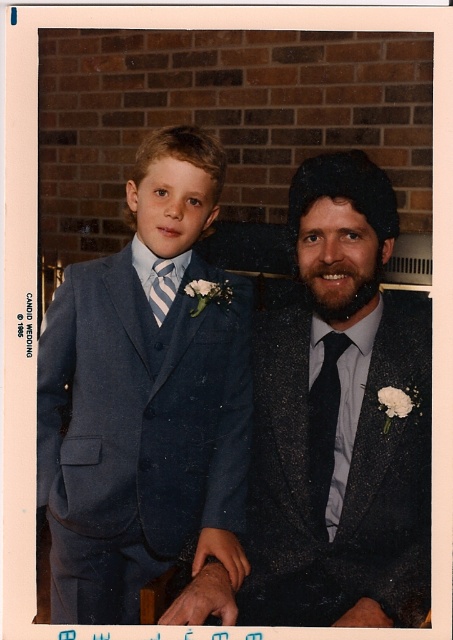
You are a photographer at a wedding and need to position the two individuals so that their heights are balanced in the photo. The subjects are wearing the matte blue suit at left and the matte black suit at center. Which suit should you move forward to make them appear the same height in the photo?

The matte blue suit at left is much taller than the matte black suit at center. To balance their heights in the photo, move the matte black suit at center forward so it appears taller, while moving the matte blue suit at left slightly back to reduce its apparent height.

You are a photographer setting up for a group photo. You see the matte black suit at center and the striped fabric tie at left in your viewfinder. Which object is located to the right of the other?

The matte black suit at center is positioned on the right side of striped fabric tie at left, so the matte black suit at center is to the right of the striped fabric tie at left.